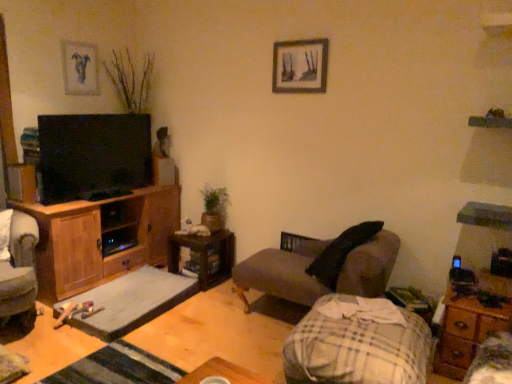
This screenshot has height=384, width=512. What are the coordinates of `vacant space to the left of dark gray fabric couch at center` in the screenshot? It's located at (206, 328).